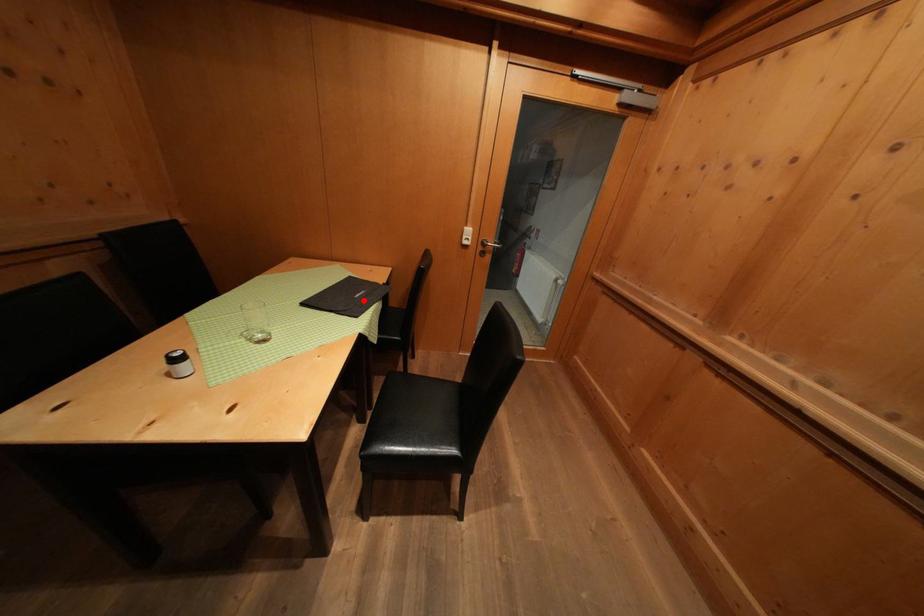
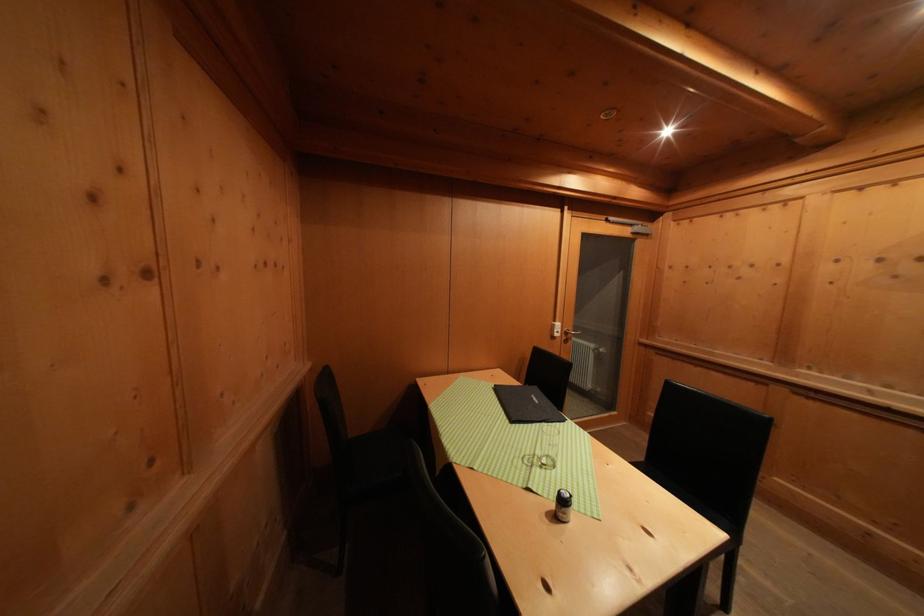
In the second image, find the point that corresponds to the highlighted location in the first image.

(542, 406)